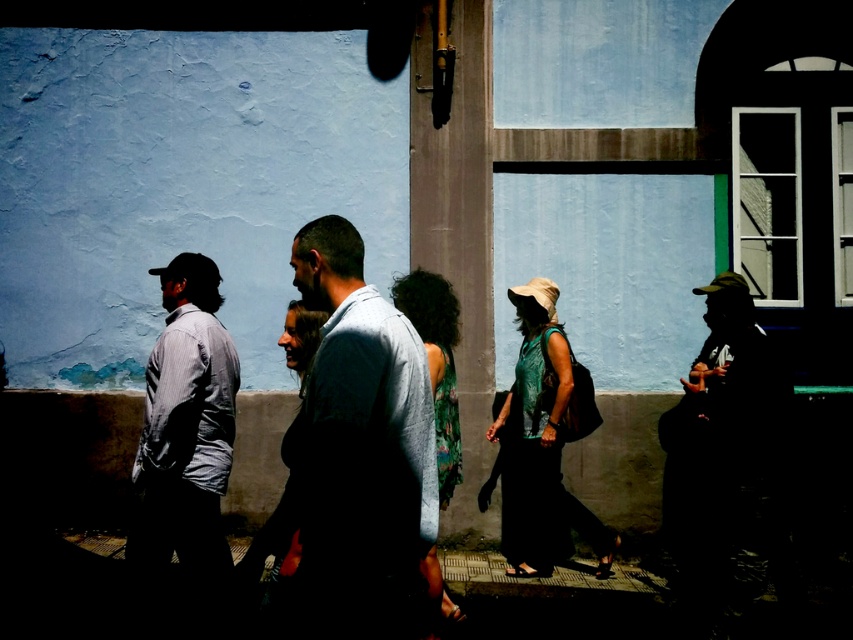
Question: Which point is closer to the camera taking this photo?

Choices:
 (A) (438, 436)
 (B) (741, 324)
 (C) (149, 429)

Answer: (C)

Question: From the image, what is the correct spatial relationship of light blue shirt at center in relation to floral fabric dress at center?

Choices:
 (A) left
 (B) right

Answer: (A)

Question: Which object is farther from the camera taking this photo?

Choices:
 (A) green textured top at center
 (B) light blue shirt at center
 (C) silhouette hat at right
 (D) light gray shirt at left

Answer: (A)

Question: Does silhouette hat at right have a greater width compared to floral fabric dress at center?

Choices:
 (A) yes
 (B) no

Answer: (A)

Question: Considering the relative positions of silhouette hat at right and floral fabric dress at center in the image provided, where is silhouette hat at right located with respect to floral fabric dress at center?

Choices:
 (A) below
 (B) above

Answer: (A)

Question: Which point is closer to the camera taking this photo?

Choices:
 (A) (373, 403)
 (B) (453, 428)
 (C) (508, 570)
 (D) (695, 536)

Answer: (A)